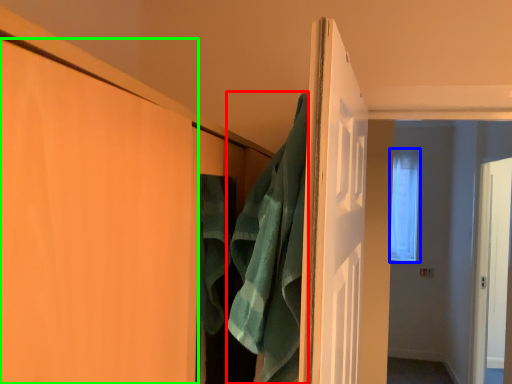
Question: Estimate the real-world distances between objects in this image. Which object is closer to bath towel (highlighted by a red box), window (highlighted by a blue box) or door (highlighted by a green box)?

Choices:
 (A) window
 (B) door

Answer: (B)